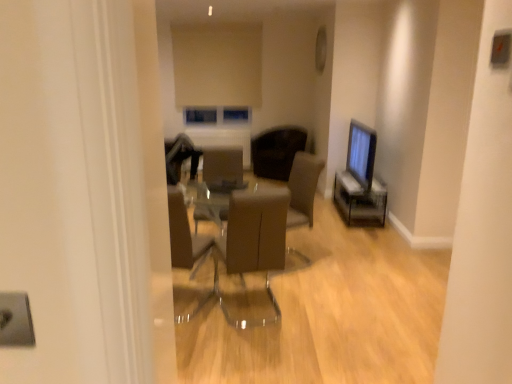
Question: Are matte brown armchair at center and brown leather chair at center, which is counted as the second chair, starting from the top, making contact?

Choices:
 (A) yes
 (B) no

Answer: (B)

Question: Is matte brown armchair at center taller than brown leather chair at center, acting as the 1th chair starting from the front?

Choices:
 (A) no
 (B) yes

Answer: (A)

Question: Considering the relative sizes of matte brown armchair at center and brown leather chair at center, acting as the 1th chair starting from the front, in the image provided, is matte brown armchair at center bigger than brown leather chair at center, acting as the 1th chair starting from the front,?

Choices:
 (A) yes
 (B) no

Answer: (B)

Question: Is matte brown armchair at center facing away from brown leather chair at center, which is counted as the second chair, starting from the top?

Choices:
 (A) no
 (B) yes

Answer: (A)

Question: Is matte brown armchair at center to the left of brown leather chair at center, acting as the 1th chair starting from the front, from the viewer's perspective?

Choices:
 (A) yes
 (B) no

Answer: (A)

Question: Is matte brown armchair at center wider or thinner than brown leather chair at center, the 2th chair positioned from the bottom?

Choices:
 (A) thin
 (B) wide

Answer: (A)

Question: Is matte brown armchair at center inside the boundaries of brown leather chair at center, the 1th chair positioned from the back, or outside?

Choices:
 (A) inside
 (B) outside

Answer: (B)

Question: From a real-world perspective, is matte brown armchair at center positioned above or below brown leather chair at center, arranged as the second chair when viewed from the front?

Choices:
 (A) below
 (B) above

Answer: (A)

Question: From the image's perspective, is matte brown armchair at center positioned above or below brown leather chair at center, which ranks as the 1th chair in top-to-bottom order?

Choices:
 (A) below
 (B) above

Answer: (A)

Question: Considering the positions of point (215, 157) and point (366, 134), is point (215, 157) closer or farther from the camera than point (366, 134)?

Choices:
 (A) closer
 (B) farther

Answer: (A)

Question: Looking at their shapes, would you say matte brown armchair at center is wider or thinner than matte black monitor at right?

Choices:
 (A) thin
 (B) wide

Answer: (B)

Question: Is matte brown armchair at center in front of or behind matte black monitor at right in the image?

Choices:
 (A) behind
 (B) front

Answer: (B)

Question: From the image's perspective, is matte brown armchair at center located above or below matte black monitor at right?

Choices:
 (A) below
 (B) above

Answer: (A)

Question: Is matte black monitor at right to the left or to the right of matte brown armchair at center in the image?

Choices:
 (A) right
 (B) left

Answer: (A)

Question: Is point coord(373,134) positioned closer to the camera than point coord(211,152)?

Choices:
 (A) farther
 (B) closer

Answer: (A)